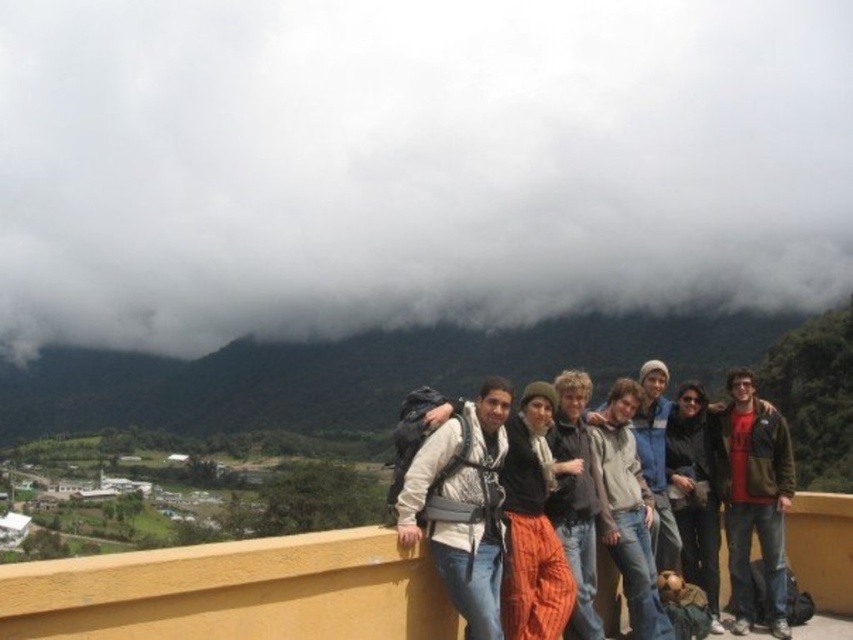
You are a photographer standing on the ledge with the group. You want to capture a photo that includes both the matte white jacket at center and the red jacket at right. Given that your camera has a maximum focus range of 50 feet, will you be able to capture both jackets in focus without moving?

The matte white jacket at center is 48.33 feet away from the red jacket at right. Since the distance between them is within the camera maximum focus range of 50 feet, you can capture both jackets in focus without moving.

You are part of a photography team setting up a shot of the group on the ledge. You need to place a small tripod between the matte white jacket at center and the red jacket at right. Based on their positions, which jacket should the tripod be closer to?

The matte white jacket at center is positioned on the left side of red jacket at right, so the tripod should be placed closer to the matte white jacket at center to ensure it is between them.